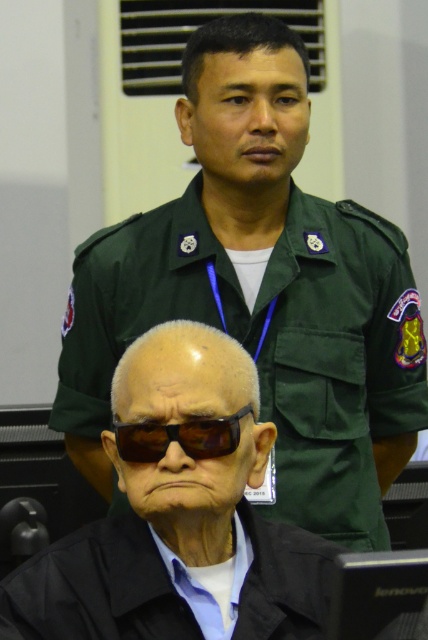
Question: Is green fabric uniform at upper center to the left of black plastic goggles at center from the viewer's perspective?

Choices:
 (A) yes
 (B) no

Answer: (A)

Question: Which point is closer to the camera taking this photo?

Choices:
 (A) (178, 440)
 (B) (219, 445)
 (C) (136, 552)

Answer: (A)

Question: Among these points, which one is farthest from the camera?

Choices:
 (A) (255, 557)
 (B) (241, 602)
 (C) (151, 461)

Answer: (A)

Question: Considering the relative positions of black matte sunglasses at lower center and green fabric uniform at upper center in the image provided, where is black matte sunglasses at lower center located with respect to green fabric uniform at upper center?

Choices:
 (A) right
 (B) left

Answer: (A)

Question: Is black matte sunglasses at lower center to the left of black plastic goggles at center from the viewer's perspective?

Choices:
 (A) yes
 (B) no

Answer: (B)

Question: Among these points, which one is nearest to the camera?

Choices:
 (A) (140, 456)
 (B) (86, 620)

Answer: (B)